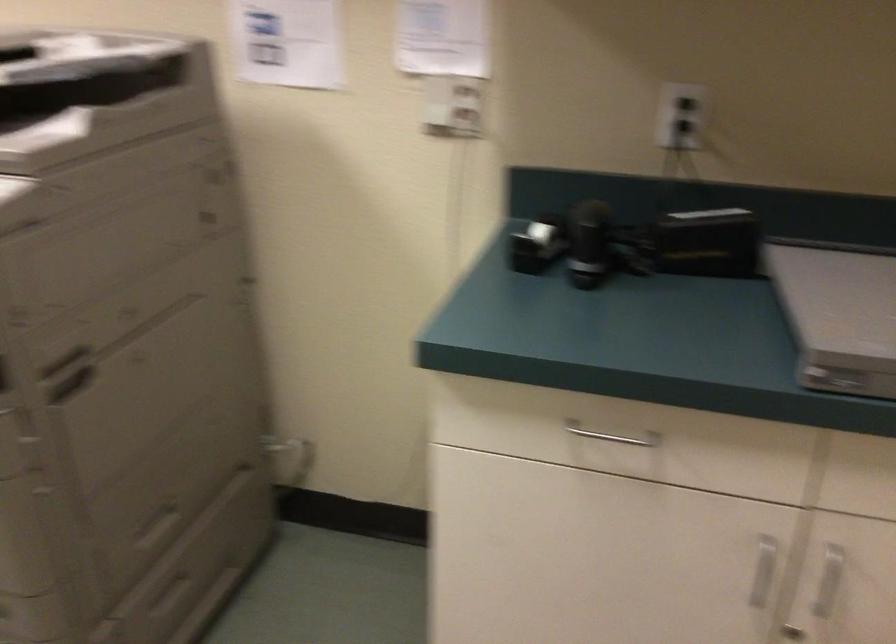
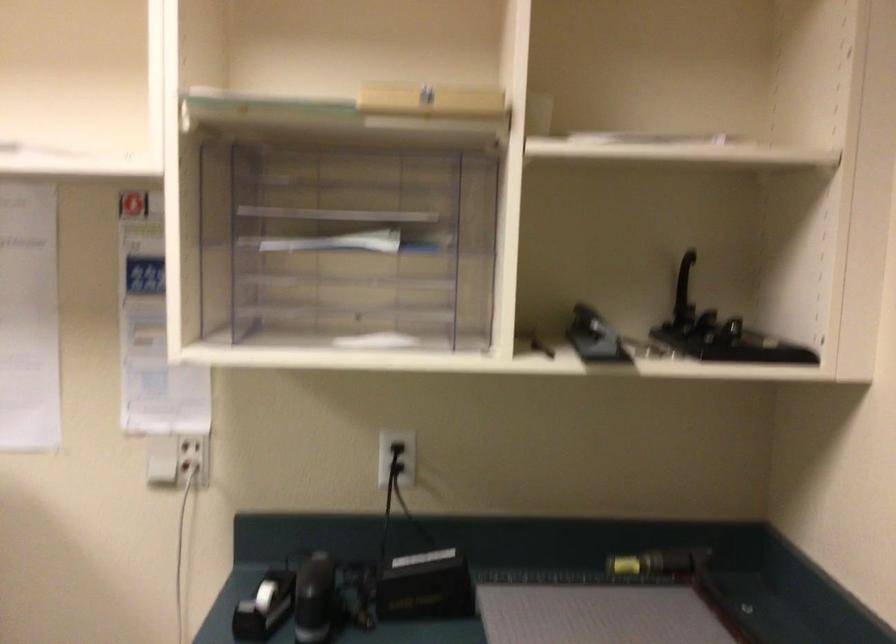
In the scene shown: The images are taken continuously from a first-person perspective. In which direction are you moving?

The cameraman moved toward right, backward.